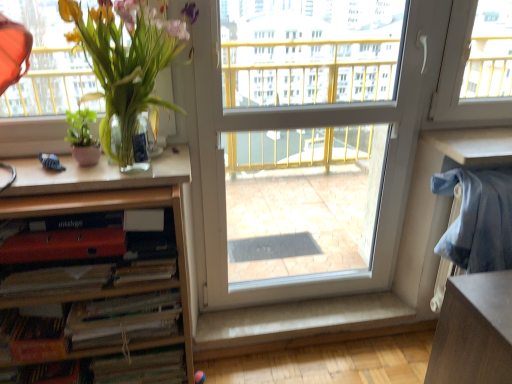
What are the coordinates of `vacant area on top of white matte paperback book at lower left, which is the second paperback book from bottom to top (from a real-world perspective)` in the screenshot? It's located at (123, 301).